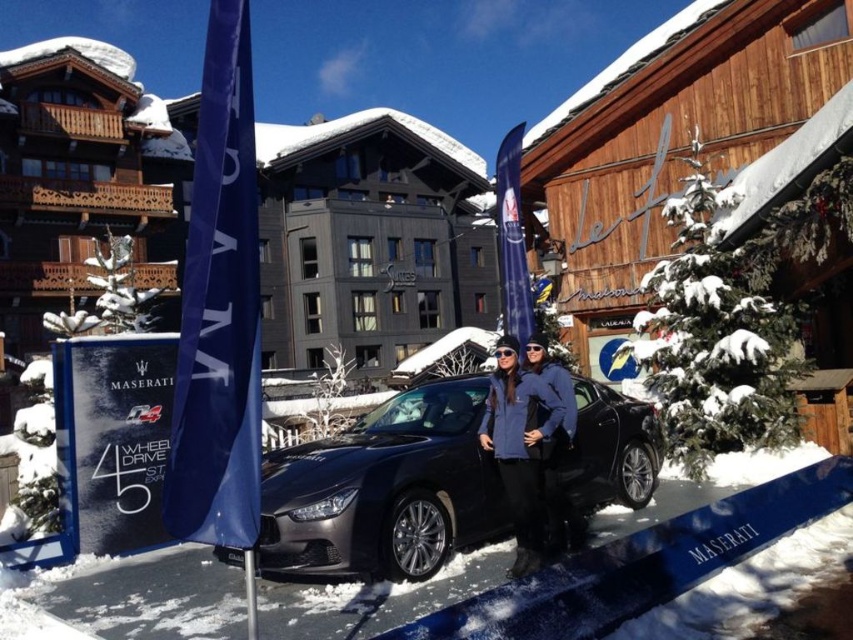
You are a photographer trying to capture the Maserati 4 promotional sign. You notice the satin black car at center and the blue fabric flag at left in your shot. Which object is blocking your view of the sign more?

The blue fabric flag at left is taller than the satin black car at center, so it is blocking the view of the Maserati 4 promotional sign more.